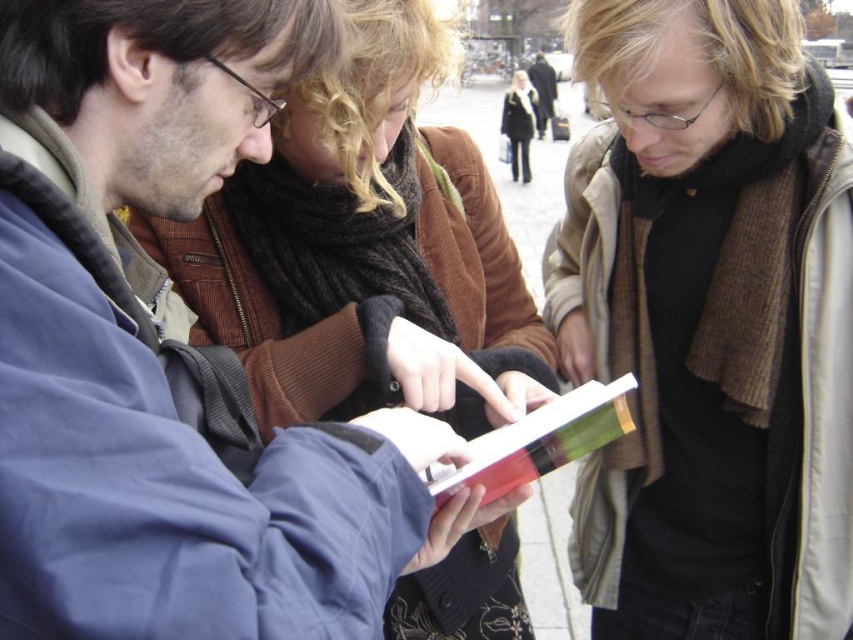
From the picture: You are a photographer trying to capture a clear shot of the red glossy book at center. However, the black wool coat at center is blocking your view. Can you adjust your position to see the book without moving the coat?

The red glossy book at center is in front of the black wool coat at center, so you can already see the book clearly without needing to move the coat.

You are a photographer standing at a certain distance from the scene. You want to take a closeup shot of the brown wool scarf at center without moving the camera. Is the current distance sufficient for a clear closeup?

The distance between the brown wool scarf at center and the camera is 14.02 feet. Since this distance is relatively far, a closeup shot may require a zoom lens or adjusting the camera settings to ensure clarity. However, without moving the camera or using additional equipment, the current distance might not be sufficient for a very clear closeup.